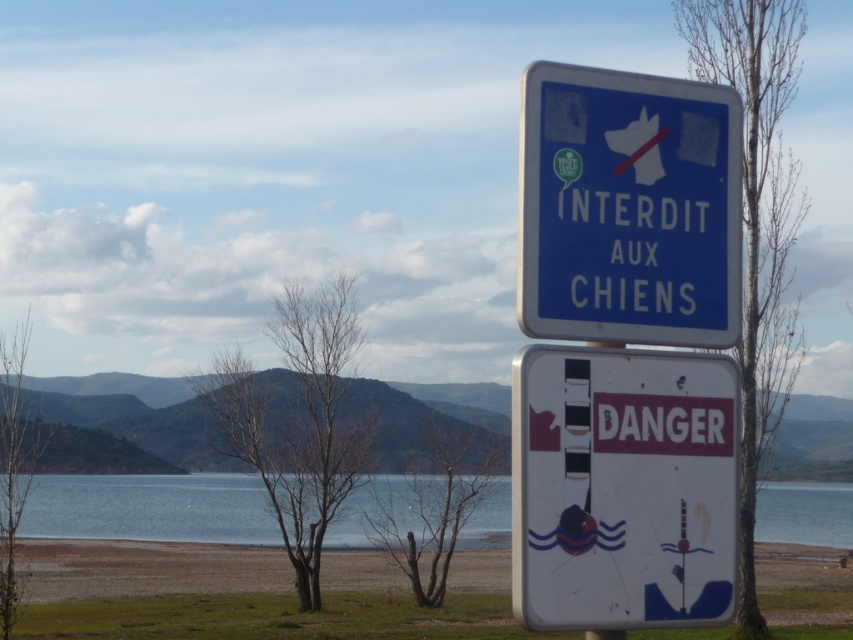
Question: Does blue plastic sign at center appear over blue water at lower center?

Choices:
 (A) no
 (B) yes

Answer: (B)

Question: Estimate the real-world distances between objects in this image. Which object is closer to the blue plastic sign at center?

Choices:
 (A) white plastic danger sign at center
 (B) blue water at lower center

Answer: (A)

Question: Which of the following is the farthest from the observer?

Choices:
 (A) (735, 420)
 (B) (830, 513)

Answer: (B)

Question: Where is blue plastic sign at center located in relation to blue water at lower center in the image?

Choices:
 (A) left
 (B) right

Answer: (A)

Question: Is white plastic danger sign at center further to camera compared to blue plastic sign at center?

Choices:
 (A) yes
 (B) no

Answer: (B)

Question: Among these objects, which one is farthest from the camera?

Choices:
 (A) blue water at lower center
 (B) blue plastic sign at center
 (C) white plastic danger sign at center

Answer: (A)